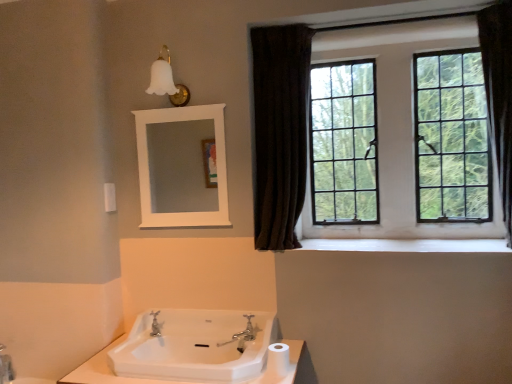
Where is `free space to the left of silver metallic faucet at center`? free space to the left of silver metallic faucet at center is located at coordinates (221, 341).